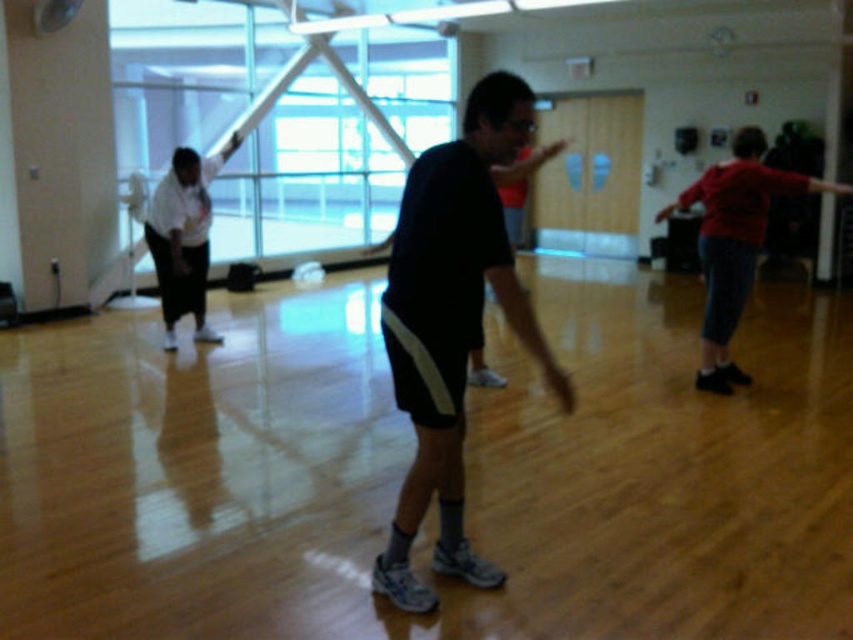
Is dark blue jersey at center positioned behind white matte shirt at left?

No, dark blue jersey at center is closer to the viewer.

Does dark blue jersey at center have a larger size compared to white matte shirt at left?

Incorrect, dark blue jersey at center is not larger than white matte shirt at left.

Is point (450, 273) closer to viewer compared to point (206, 268)?

Yes, point (450, 273) is in front of point (206, 268).

Where is `dark blue jersey at center`? The image size is (853, 640). dark blue jersey at center is located at coordinates click(451, 323).